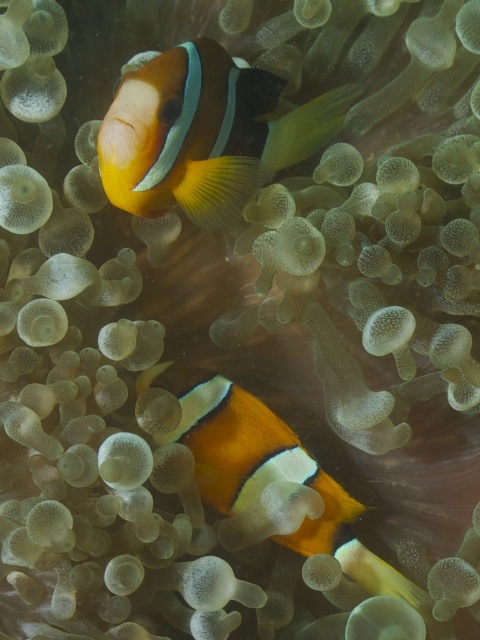
You are a marine biologist observing the clownfish in the sea anemone. You notice two points marked in the image. Which point is closer to you, point (x=128, y=122) or point (x=181, y=403)?

Point (x=128, y=122) is in front of point (x=181, y=403), so it is closer to you.